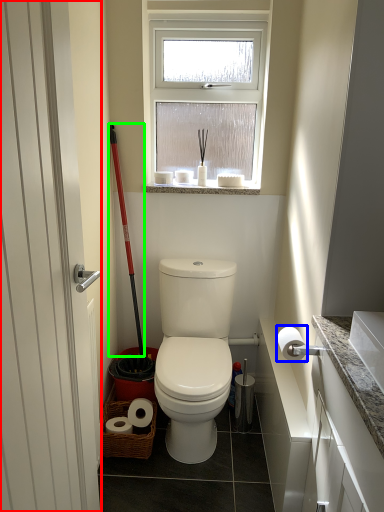
Question: Which is farther away from screen door (highlighted by a red box)? toilet paper (highlighted by a blue box) or ski pole (highlighted by a green box)?

Choices:
 (A) toilet paper
 (B) ski pole

Answer: (B)